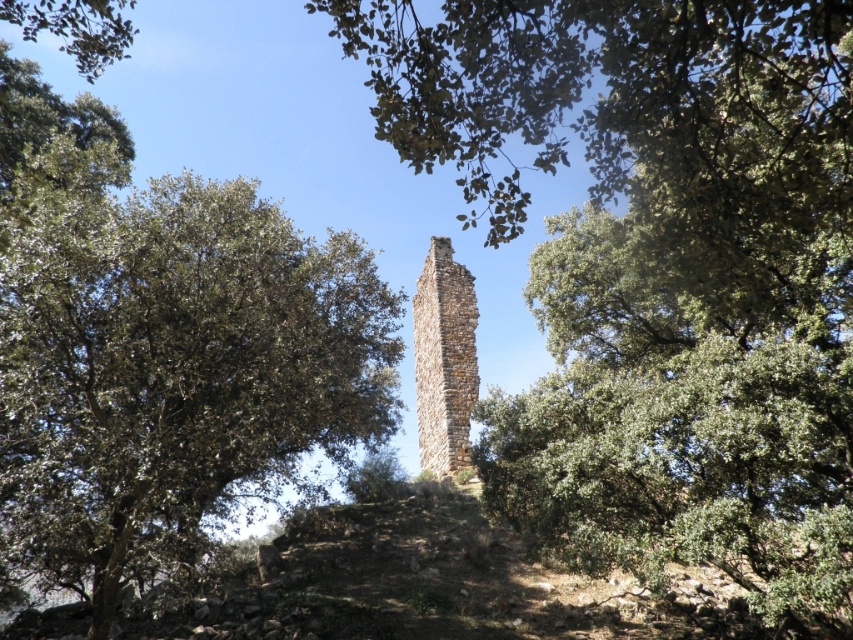
Question: Which object is closer to the camera taking this photo?

Choices:
 (A) brown stone chimney at center
 (B) green leafy tree at left

Answer: (B)

Question: Which point appears closest to the camera in this image?

Choices:
 (A) (245, 259)
 (B) (437, 396)

Answer: (A)

Question: Does green leafy tree at left lie behind brown stone chimney at center?

Choices:
 (A) yes
 (B) no

Answer: (B)

Question: Does green leafy tree at left appear on the left side of brown stone chimney at center?

Choices:
 (A) no
 (B) yes

Answer: (B)

Question: Can you confirm if green leafy tree at left is positioned above brown stone chimney at center?

Choices:
 (A) no
 (B) yes

Answer: (B)